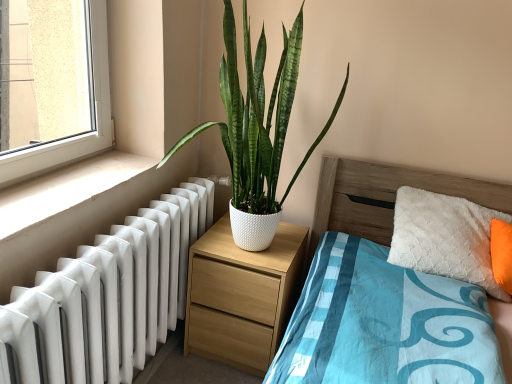
The width and height of the screenshot is (512, 384). Identify the location of white smooth window sill at lower left. (66, 189).

What do you see at coordinates (66, 189) in the screenshot? I see `white smooth window sill at lower left` at bounding box center [66, 189].

This screenshot has width=512, height=384. Identify the location of white glossy radiator at left. (109, 296).

The width and height of the screenshot is (512, 384). I want to click on white textured pot at center, so [x=256, y=130].

This screenshot has height=384, width=512. In order to click on white smooth window sill at lower left in this screenshot , I will do `click(66, 189)`.

Relative to white textured pot at center, is white smooth window sill at lower left in front or behind?

Clearly, white smooth window sill at lower left is in front of white textured pot at center.

Can you confirm if white smooth window sill at lower left is taller than white textured pot at center?

No, white smooth window sill at lower left is not taller than white textured pot at center.

Visually, is white smooth window sill at lower left positioned to the left or to the right of white textured pot at center?

Based on their positions, white smooth window sill at lower left is located to the left of white textured pot at center.

Considering the sizes of objects white smooth window sill at lower left and white textured pot at center in the image provided, who is thinner, white smooth window sill at lower left or white textured pot at center?

Thinner between the two is white smooth window sill at lower left.

Choose the correct answer: Is white textured pot at center inside light wood/texture nightstand at center or outside it?

white textured pot at center cannot be found inside light wood/texture nightstand at center.

Is white textured pot at center closer to the viewer compared to light wood/texture nightstand at center?

Yes, it is in front of light wood/texture nightstand at center.

From the image's perspective, between white textured pot at center and light wood/texture nightstand at center, who is located below?

From the image's view, light wood/texture nightstand at center is below.

Could you tell me if white textured pot at center is facing light wood/texture nightstand at center?

No, white textured pot at center is not facing towards light wood/texture nightstand at center.

In terms of height, does white glossy radiator at left look taller or shorter compared to wooden bed at center?

Clearly, white glossy radiator at left is shorter compared to wooden bed at center.

Can you confirm if white glossy radiator at left is thinner than wooden bed at center?

Correct, the width of white glossy radiator at left is less than that of wooden bed at center.

Considering the positions of objects white glossy radiator at left and wooden bed at center in the image provided, who is more to the left, white glossy radiator at left or wooden bed at center?

From the viewer's perspective, white glossy radiator at left appears more on the left side.

Can you confirm if white smooth window sill at lower left is positioned to the right of wooden bed at center?

In fact, white smooth window sill at lower left is to the left of wooden bed at center.

Consider the image. Is white smooth window sill at lower left positioned in front of wooden bed at center?

That is False.

Between white smooth window sill at lower left and wooden bed at center, which one has smaller width?

white smooth window sill at lower left.

From a real-world perspective, is white smooth window sill at lower left on top of wooden bed at center?

Yes.

What are the coordinates of `houseplant located above the light wood/texture nightstand at center (from the image's perspective)` in the screenshot? It's located at (256, 130).

Is light wood/texture nightstand at center looking in the opposite direction of white textured pot at center?

No, light wood/texture nightstand at center is not facing the opposite direction of white textured pot at center.

Considering the relative positions of light wood/texture nightstand at center and white textured pot at center in the image provided, is light wood/texture nightstand at center to the right of white textured pot at center from the viewer's perspective?

No.

Is white glossy radiator at left completely or partially outside of light wood/texture nightstand at center?

Yes, white glossy radiator at left is outside of light wood/texture nightstand at center.

Can you tell me how much white glossy radiator at left and light wood/texture nightstand at center differ in facing direction?

They differ by 5.31e-05 degrees in their facing directions.

Would you say white glossy radiator at left is a long distance from light wood/texture nightstand at center?

Actually, white glossy radiator at left and light wood/texture nightstand at center are a little close together.

Find the location of a particular element. Image resolution: width=512 pixels, height=384 pixels. nightstand located on the right of white glossy radiator at left is located at coordinates point(241,296).

Does wooden bed at center appear on the left side of white smooth window sill at lower left?

No.

Between wooden bed at center and white smooth window sill at lower left, which one has larger width?

With larger width is wooden bed at center.

Does wooden bed at center touch white smooth window sill at lower left?

wooden bed at center and white smooth window sill at lower left are not in contact.

In order to click on houseplant that is behind the white smooth window sill at lower left in this screenshot , I will do `click(256, 130)`.

Identify the location of nightstand that appears on the left of white textured pot at center. (241, 296).

Considering their positions, is wooden bed at center positioned further to white smooth window sill at lower left than light wood/texture nightstand at center?

Among the two, wooden bed at center is located further to white smooth window sill at lower left.

Estimate the real-world distances between objects in this image. Which object is closer to white smooth window sill at lower left, white glossy radiator at left or white textured pot at center?

white glossy radiator at left.

In the scene shown: Estimate the real-world distances between objects in this image. Which object is further from white smooth window sill at lower left, light wood/texture nightstand at center or white glossy radiator at left?

Based on the image, light wood/texture nightstand at center appears to be further to white smooth window sill at lower left.

Estimate the real-world distances between objects in this image. Which object is further from wooden bed at center, light wood/texture nightstand at center or white glossy radiator at left?

Based on the image, white glossy radiator at left appears to be further to wooden bed at center.

From the image, which object appears to be nearer to white glossy radiator at left, white textured pot at center or wooden bed at center?

white textured pot at center is closer to white glossy radiator at left.

Looking at the image, which one is located further to wooden bed at center, white textured pot at center or white smooth window sill at lower left?

white smooth window sill at lower left is further to wooden bed at center.

Which object lies further to the anchor point white glossy radiator at left, white smooth window sill at lower left or wooden bed at center?

wooden bed at center.

Estimate the real-world distances between objects in this image. Which object is further from light wood/texture nightstand at center, white textured pot at center or white glossy radiator at left?

white textured pot at center.

The width and height of the screenshot is (512, 384). Find the location of `radiator between white smooth window sill at lower left and white textured pot at center`. radiator between white smooth window sill at lower left and white textured pot at center is located at coordinates (109, 296).

Where is `radiator located between wooden bed at center and light wood/texture nightstand at center in the depth direction`? Image resolution: width=512 pixels, height=384 pixels. radiator located between wooden bed at center and light wood/texture nightstand at center in the depth direction is located at coordinates pos(109,296).

Locate an element on the screen. The image size is (512, 384). houseplant situated between white smooth window sill at lower left and wooden bed at center from left to right is located at coordinates (256, 130).

I want to click on radiator between white textured pot at center and light wood/texture nightstand at center in the up-down direction, so click(x=109, y=296).